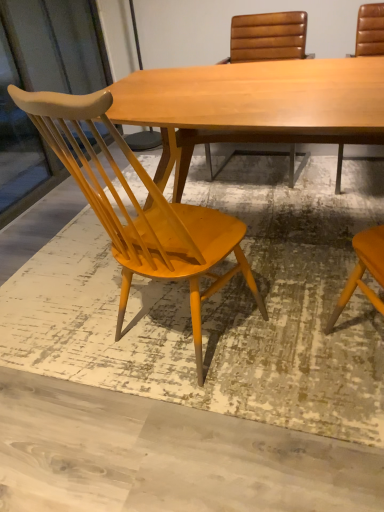
This screenshot has height=512, width=384. Describe the element at coordinates (268, 37) in the screenshot. I see `leather-like brown chair at upper center, placed as the second chair when sorted from right to left` at that location.

What is the approximate width of leather-like brown chair at upper center, placed as the second chair when sorted from right to left?

leather-like brown chair at upper center, placed as the second chair when sorted from right to left, is 60.80 centimeters wide.

Locate an element on the screen. This screenshot has height=512, width=384. matte wood screen door at left is located at coordinates (56, 45).

What do you see at coordinates (140, 209) in the screenshot?
I see `matte yellow wood chair at left, marked as the 1th chair in a left-to-right arrangement` at bounding box center [140, 209].

What is the approximate height of leather at right, which is the 1th chair from right to left?

The height of leather at right, which is the 1th chair from right to left, is 90.67 centimeters.

Find the location of `leather-like brown chair at upper center, placed as the second chair when sorted from right to left`. leather-like brown chair at upper center, placed as the second chair when sorted from right to left is located at coordinates (268, 37).

From a real-world perspective, which chair is the 1st one underneath the matte yellow wood chair at left, marked as the 1th chair in a left-to-right arrangement? Please provide its 2D coordinates.

[(369, 31)]

Does leather at right, the third chair when ordered from left to right, have a greater width compared to matte yellow wood chair at left, marked as the 1th chair in a left-to-right arrangement?

Yes, leather at right, the third chair when ordered from left to right, is wider than matte yellow wood chair at left, marked as the 1th chair in a left-to-right arrangement.

Can matte yellow wood chair at left, marked as the 1th chair in a left-to-right arrangement, be found inside leather at right, the third chair when ordered from left to right?

Definitely not — matte yellow wood chair at left, marked as the 1th chair in a left-to-right arrangement, is not inside leather at right, the third chair when ordered from left to right.

Does matte yellow wood chair at left, marked as the 1th chair in a left-to-right arrangement, have a lesser height compared to matte wood screen door at left?

Yes, matte yellow wood chair at left, marked as the 1th chair in a left-to-right arrangement, is shorter than matte wood screen door at left.

Considering the sizes of objects matte yellow wood chair at left, marked as the 1th chair in a left-to-right arrangement, and matte wood screen door at left in the image provided, who is thinner, matte yellow wood chair at left, marked as the 1th chair in a left-to-right arrangement, or matte wood screen door at left?

matte wood screen door at left.

Can you confirm if matte yellow wood chair at left, marked as the 1th chair in a left-to-right arrangement, is smaller than matte wood screen door at left?

No, matte yellow wood chair at left, marked as the 1th chair in a left-to-right arrangement, is not smaller than matte wood screen door at left.

From the image's perspective, count 3rd chairs downward from the matte wood screen door at left and point to it. Please provide its 2D coordinates.

[(140, 209)]

Looking at this image, considering the positions of objects matte wood screen door at left and matte yellow wood chair at left, marked as the 1th chair in a left-to-right arrangement, in the image provided, who is more to the left, matte wood screen door at left or matte yellow wood chair at left, marked as the 1th chair in a left-to-right arrangement,?

Positioned to the left is matte wood screen door at left.

Which object is thinner, matte wood screen door at left or matte yellow wood chair at left, marked as the 1th chair in a left-to-right arrangement?

Thinner between the two is matte wood screen door at left.

Can you confirm if matte wood screen door at left is smaller than matte yellow wood chair at left, marked as the 1th chair in a left-to-right arrangement?

Yes.

Is matte yellow wood chair at left, marked as the 1th chair in a left-to-right arrangement, next to leather at right, which is the 1th chair from right to left, and touching it?

No.

What's the angular difference between matte yellow wood chair at left, the 3th chair positioned from the right, and leather at right, the third chair when ordered from left to right,'s facing directions?

The facing directions of matte yellow wood chair at left, the 3th chair positioned from the right, and leather at right, the third chair when ordered from left to right, are 167 degrees apart.

Looking at the image, does matte yellow wood chair at left, marked as the 1th chair in a left-to-right arrangement, seem bigger or smaller compared to leather at right, which is the 1th chair from right to left?

Clearly, matte yellow wood chair at left, marked as the 1th chair in a left-to-right arrangement, is larger in size than leather at right, which is the 1th chair from right to left.

Is point (122, 208) farther from camera compared to point (383, 38)?

No, it is not.

Considering the relative positions of matte wood screen door at left and leather at right, the third chair when ordered from left to right, in the image provided, is matte wood screen door at left to the left of leather at right, the third chair when ordered from left to right, from the viewer's perspective?

Indeed, matte wood screen door at left is positioned on the left side of leather at right, the third chair when ordered from left to right.

Considering the relative sizes of matte wood screen door at left and leather at right, which is the 1th chair from right to left, in the image provided, is matte wood screen door at left smaller than leather at right, which is the 1th chair from right to left,?

Incorrect, matte wood screen door at left is not smaller in size than leather at right, which is the 1th chair from right to left.

In the scene shown: Which object is wider, matte wood screen door at left or leather at right, which is the 1th chair from right to left?

leather at right, which is the 1th chair from right to left.

How much distance is there between matte wood screen door at left and leather-like brown chair at upper center, placed as the second chair when sorted from right to left?

They are 5.02 feet apart.

Is matte wood screen door at left not close to leather-like brown chair at upper center, placed as the second chair when sorted from right to left?

Yes.

Is matte wood screen door at left looking in the opposite direction of leather-like brown chair at upper center, placed as the second chair when sorted from right to left?

No.

In the image, is leather-like brown chair at upper center, placed as the second chair when sorted from right to left, on the left side or the right side of matte wood screen door at left?

leather-like brown chair at upper center, placed as the second chair when sorted from right to left, is positioned on matte wood screen door at left's right side.

Is leather-like brown chair at upper center, placed as the second chair when sorted from right to left, closer to the viewer compared to matte wood screen door at left?

No, the depth of leather-like brown chair at upper center, placed as the second chair when sorted from right to left, is greater than that of matte wood screen door at left.

From a real-world perspective, is leather-like brown chair at upper center, placed as the second chair when sorted from right to left, on matte wood screen door at left?

No, from a real-world perspective, leather-like brown chair at upper center, placed as the second chair when sorted from right to left, is not over matte wood screen door at left

Is point (293, 156) in front of point (16, 38)?

Yes, it is.

In order to click on chair that is the 1st one when counting backward from the matte yellow wood chair at left, marked as the 1th chair in a left-to-right arrangement in this screenshot , I will do `click(369, 31)`.

From the matte wood screen door at left, count 1st chair to the right and point to it. Please provide its 2D coordinates.

[(140, 209)]

Looking at the image, which one is located further to leather at right, the third chair when ordered from left to right, matte yellow wood chair at left, the 3th chair positioned from the right, or leather-like brown chair at upper center, placed as the second chair when sorted from right to left?

The object further to leather at right, the third chair when ordered from left to right, is matte yellow wood chair at left, the 3th chair positioned from the right.

Looking at the image, which one is located closer to matte wood screen door at left, matte yellow wood chair at left, marked as the 1th chair in a left-to-right arrangement, or leather-like brown chair at upper center, which ranks as the second chair in left-to-right order?

leather-like brown chair at upper center, which ranks as the second chair in left-to-right order.

Estimate the real-world distances between objects in this image. Which object is closer to matte yellow wood chair at left, the 3th chair positioned from the right, matte wood screen door at left or leather-like brown chair at upper center, placed as the second chair when sorted from right to left?

Among the two, leather-like brown chair at upper center, placed as the second chair when sorted from right to left, is located nearer to matte yellow wood chair at left, the 3th chair positioned from the right.

From the image, which object appears to be nearer to matte wood screen door at left, leather-like brown chair at upper center, which ranks as the second chair in left-to-right order, or matte yellow wood chair at left, marked as the 1th chair in a left-to-right arrangement?

leather-like brown chair at upper center, which ranks as the second chair in left-to-right order.

Estimate the real-world distances between objects in this image. Which object is closer to matte yellow wood chair at left, the 3th chair positioned from the right, leather-like brown chair at upper center, placed as the second chair when sorted from right to left, or matte wood screen door at left?

leather-like brown chair at upper center, placed as the second chair when sorted from right to left, is positioned closer to the anchor matte yellow wood chair at left, the 3th chair positioned from the right.

Considering their positions, is leather at right, the third chair when ordered from left to right, positioned further to leather-like brown chair at upper center, which ranks as the second chair in left-to-right order, than matte wood screen door at left?

The object further to leather-like brown chair at upper center, which ranks as the second chair in left-to-right order, is matte wood screen door at left.

In the scene shown: From the image, which object appears to be farther from leather-like brown chair at upper center, which ranks as the second chair in left-to-right order, matte yellow wood chair at left, the 3th chair positioned from the right, or matte wood screen door at left?

Based on the image, matte yellow wood chair at left, the 3th chair positioned from the right, appears to be further to leather-like brown chair at upper center, which ranks as the second chair in left-to-right order.

Looking at the image, which one is located further to matte wood screen door at left, leather-like brown chair at upper center, placed as the second chair when sorted from right to left, or leather at right, the third chair when ordered from left to right?

leather at right, the third chair when ordered from left to right, is positioned further to the anchor matte wood screen door at left.

At what (x,y) coordinates should I click in order to perform the action: click on screen door between matte yellow wood chair at left, the 3th chair positioned from the right, and leather-like brown chair at upper center, placed as the second chair when sorted from right to left, along the z-axis. Please return your answer as a coordinate pair (x, y). The image size is (384, 512). Looking at the image, I should click on (56, 45).

This screenshot has width=384, height=512. I want to click on chair between matte yellow wood chair at left, the 3th chair positioned from the right, and leather-like brown chair at upper center, which ranks as the second chair in left-to-right order, from front to back, so (x=369, y=31).